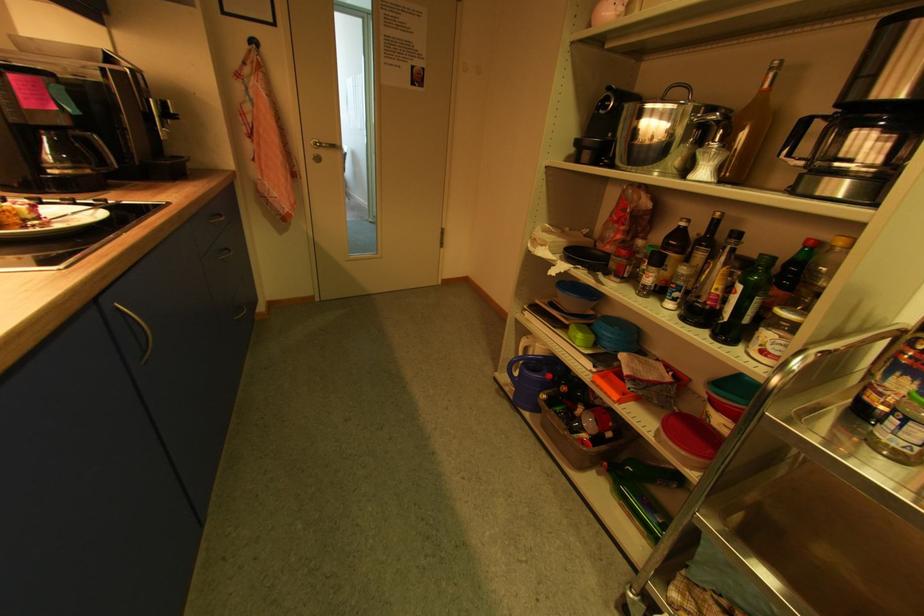
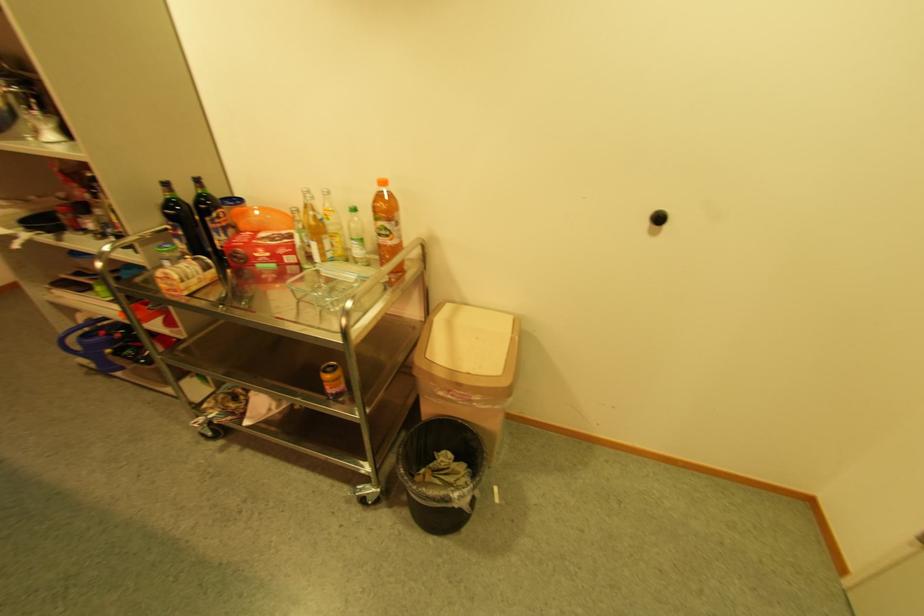
Locate, in the second image, the point that corresponds to pixel 531 346 in the first image.

(91, 320)